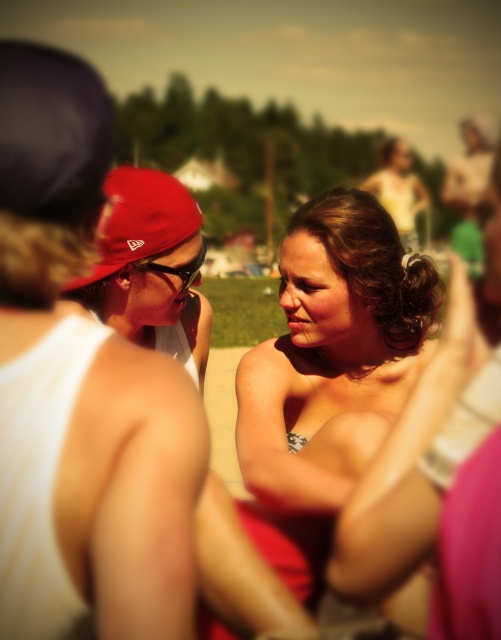
You are a photographer standing at a distance of 6 feet from the woman in the center. You want to take a closeup shot of the shiny gold necklace at center. Is the necklace within your camera range?

The shiny gold necklace at center is 5.59 feet away from the camera, so yes, it is within your camera range since the photographer is standing at 6 feet distance.